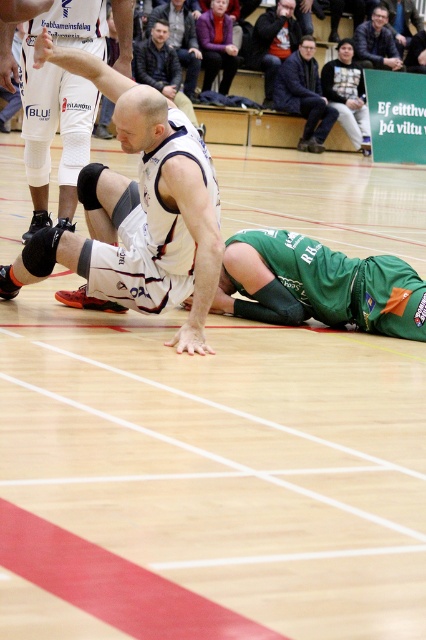
You are a referee observing the game. You notice the white matte basketball jersey at center and the white matte basketball player at center. Which one has a larger size?

The white matte basketball player at center has a larger size compared to the white matte basketball jersey at center.

What is the 2D coordinate of the dark gray jacket at upper center in the basketball game image?

The dark gray jacket at upper center is located at the 2D coordinate point of (273, 42).

You are a sports analyst watching the game. You notice two white jerseys at center court. One is labeled as the white jersey at center, and the other is the white matte basketball jersey at center. Which of these two jerseys has a narrower design?

The white jersey at center has a lesser width compared to the white matte basketball jersey at center, so the white jersey at center is narrower.